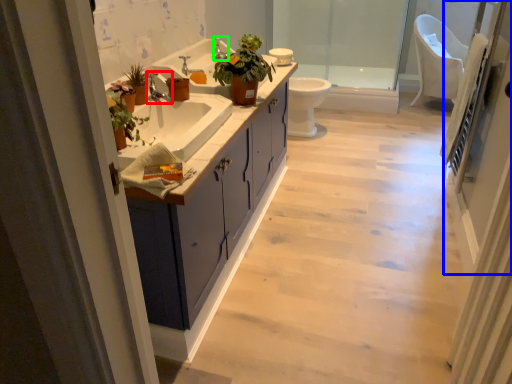
Question: Considering the real-world distances, which object is closest to faucet (highlighted by a red box)? screen door (highlighted by a blue box) or faucet (highlighted by a green box).

Choices:
 (A) screen door
 (B) faucet

Answer: (B)